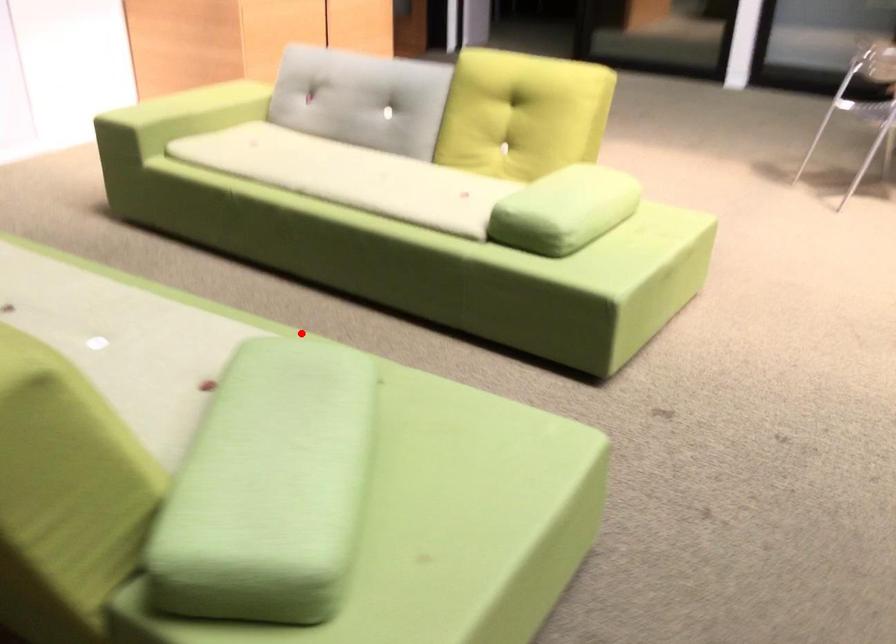
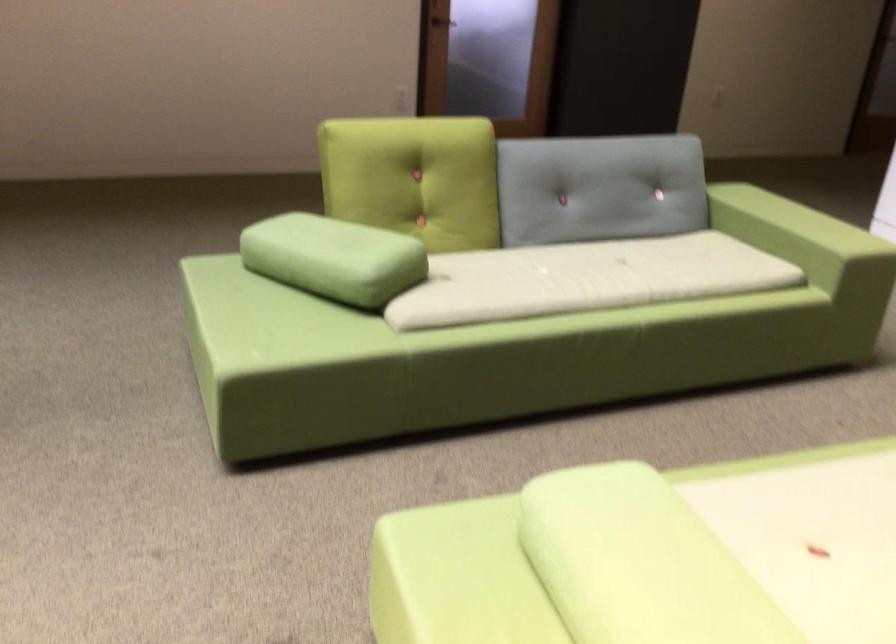
Where in the second image is the point corresponding to the highlighted location from the first image?

(504, 334)